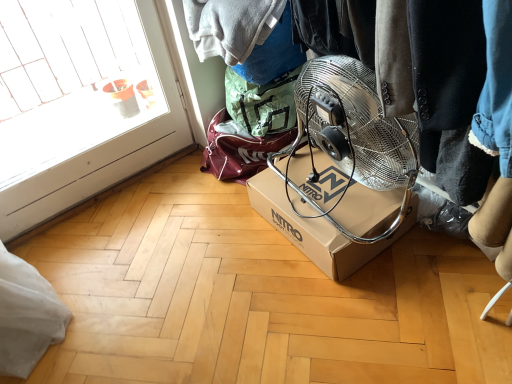
Where is `free location in front of brown cardboard box at center`? free location in front of brown cardboard box at center is located at coordinates (358, 310).